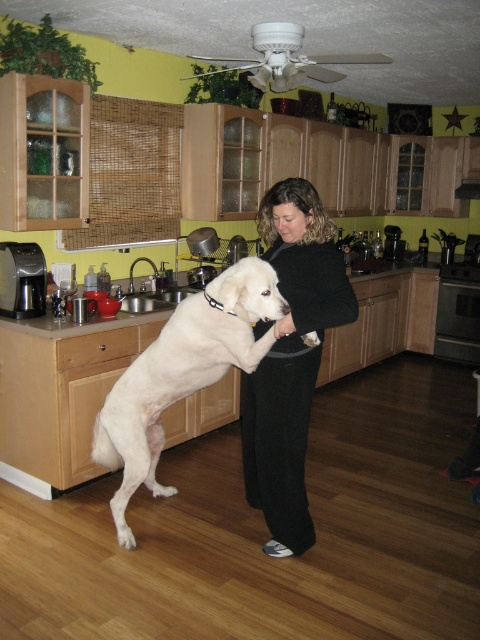
You are a tailor measuring for a new pair of pants. You see the black soft pants at center and the white fluffy dog at center in the kitchen. Which item has a greater width?

The white fluffy dog at center is wider than the black soft pants at center, so the dog has a greater width.

You are a delivery person who needs to deliver a package to the kitchen. You see the black soft pants at center and the white fluffy dog at center. Which object is on the right side from your perspective?

The black soft pants at center is positioned on the right side of the white fluffy dog at center, so the black soft pants at center is on the right side.